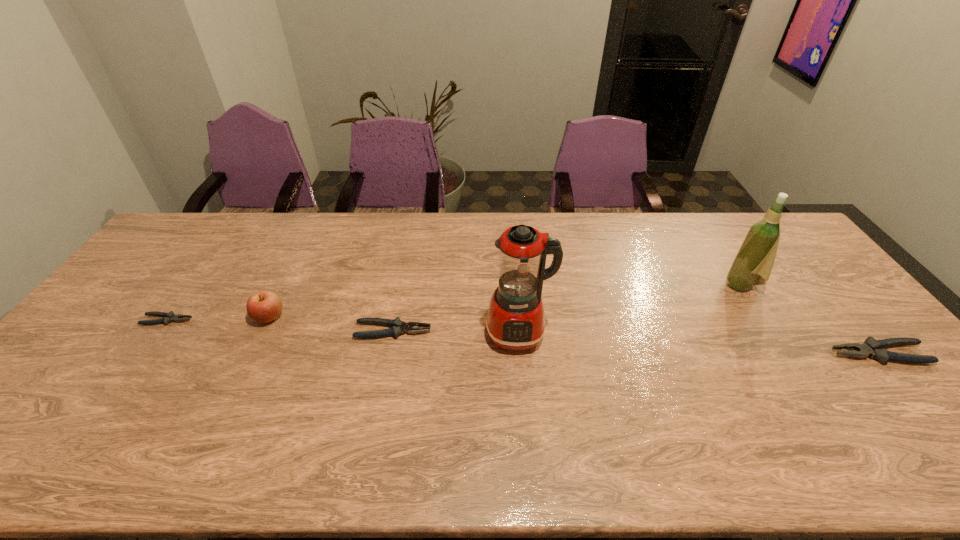
At what (x,y) coordinates should I click in order to perform the action: click on the shortest object. Please return your answer as a coordinate pair (x, y). Looking at the image, I should click on (169, 317).

Where is `the leftmost object`? The image size is (960, 540). the leftmost object is located at coordinates (169, 317).

At what (x,y) coordinates should I click in order to perform the action: click on the third object from left to right. Please return your answer as a coordinate pair (x, y). The height and width of the screenshot is (540, 960). Looking at the image, I should click on (398, 327).

This screenshot has height=540, width=960. I want to click on the second shortest object, so click(x=398, y=327).

Where is `the rightmost pliers`? The width and height of the screenshot is (960, 540). the rightmost pliers is located at coordinates (871, 347).

Identify the location of the rightmost object. The image size is (960, 540). (871, 347).

This screenshot has width=960, height=540. In order to click on the fifth object from left to right in this screenshot , I will do `click(754, 261)`.

This screenshot has width=960, height=540. I want to click on wine bottle, so click(x=754, y=261).

I want to click on the fourth object from left to right, so click(x=515, y=321).

What are the coordinates of `the fourth shortest object` in the screenshot? It's located at (264, 306).